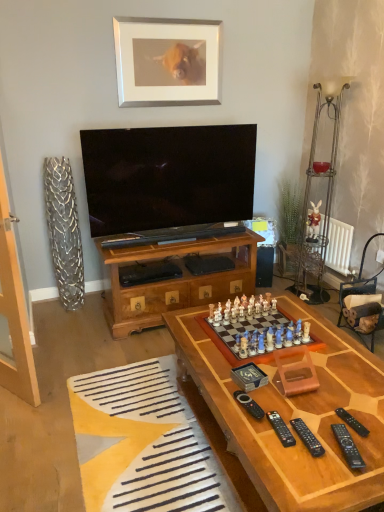
At what (x,y) coordinates should I click in order to perform the action: click on free space in front of black plastic remote at lower right, the first remote when ordered from right to left. Please return your answer as a coordinate pair (x, y). This screenshot has height=512, width=384. Looking at the image, I should click on (354, 458).